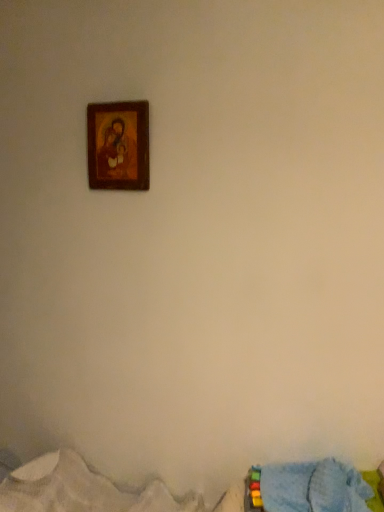
The height and width of the screenshot is (512, 384). I want to click on blue textured blanket at lower right, arranged as the first bed when ordered from the bottom, so click(x=82, y=490).

This screenshot has height=512, width=384. I want to click on blue fabric bed at lower right, which is the second bed from bottom to top, so click(324, 488).

From a real-world perspective, is blue fabric bed at lower right, which is the second bed from bottom to top, above or below wooden frame at upper center?

From a real-world perspective, blue fabric bed at lower right, which is the second bed from bottom to top, is physically below wooden frame at upper center.

Who is taller, blue fabric bed at lower right, marked as the 1th bed in a top-to-bottom arrangement, or wooden frame at upper center?

Standing taller between the two is wooden frame at upper center.

Which point is more forward, (275, 504) or (114, 172)?

Positioned in front is point (275, 504).

Consider the image. From the image's perspective, which one is positioned lower, blue fabric bed at lower right, which is the second bed from bottom to top, or wooden frame at upper center?

blue fabric bed at lower right, which is the second bed from bottom to top, appears lower in the image.

At what (x,y) coordinates should I click in order to perform the action: click on picture frame above the blue textured blanket at lower right, arranged as the first bed when ordered from the bottom (from a real-world perspective). Please return your answer as a coordinate pair (x, y). This screenshot has width=384, height=512. Looking at the image, I should click on (118, 145).

Is wooden frame at upper center positioned far away from blue textured blanket at lower right, arranged as the first bed when ordered from the bottom?

Yes, wooden frame at upper center is far from blue textured blanket at lower right, arranged as the first bed when ordered from the bottom.

Considering the sizes of objects wooden frame at upper center and blue textured blanket at lower right, arranged as the first bed when ordered from the bottom, in the image provided, who is smaller, wooden frame at upper center or blue textured blanket at lower right, arranged as the first bed when ordered from the bottom,?

With smaller size is wooden frame at upper center.

Is wooden frame at upper center taller or shorter than blue textured blanket at lower right, which is counted as the second bed, starting from the top?

Clearly, wooden frame at upper center is taller compared to blue textured blanket at lower right, which is counted as the second bed, starting from the top.

Are blue textured blanket at lower right, which is counted as the second bed, starting from the top, and wooden frame at upper center making contact?

No, blue textured blanket at lower right, which is counted as the second bed, starting from the top, is not making contact with wooden frame at upper center.

Is blue textured blanket at lower right, which is counted as the second bed, starting from the top, oriented towards wooden frame at upper center?

No, blue textured blanket at lower right, which is counted as the second bed, starting from the top, is not aimed at wooden frame at upper center.

From a real-world perspective, is blue textured blanket at lower right, arranged as the first bed when ordered from the bottom, positioned under wooden frame at upper center based on gravity?

Yes, from a real-world perspective, blue textured blanket at lower right, arranged as the first bed when ordered from the bottom, is beneath wooden frame at upper center.

Who is taller, blue fabric bed at lower right, marked as the 1th bed in a top-to-bottom arrangement, or blue textured blanket at lower right, which is counted as the second bed, starting from the top?

With more height is blue fabric bed at lower right, marked as the 1th bed in a top-to-bottom arrangement.

Is the surface of blue fabric bed at lower right, marked as the 1th bed in a top-to-bottom arrangement, in direct contact with blue textured blanket at lower right, which is counted as the second bed, starting from the top?

No, blue fabric bed at lower right, marked as the 1th bed in a top-to-bottom arrangement, is not in contact with blue textured blanket at lower right, which is counted as the second bed, starting from the top.

Can you confirm if blue fabric bed at lower right, which is the second bed from bottom to top, is smaller than blue textured blanket at lower right, arranged as the first bed when ordered from the bottom?

Yes, blue fabric bed at lower right, which is the second bed from bottom to top, is smaller than blue textured blanket at lower right, arranged as the first bed when ordered from the bottom.

Is blue fabric bed at lower right, which is the second bed from bottom to top, positioned with its back to blue textured blanket at lower right, arranged as the first bed when ordered from the bottom?

Yes, blue textured blanket at lower right, arranged as the first bed when ordered from the bottom, is at the back of blue fabric bed at lower right, which is the second bed from bottom to top.

From a real-world perspective, relative to blue fabric bed at lower right, which is the second bed from bottom to top, is blue textured blanket at lower right, which is counted as the second bed, starting from the top, vertically above or below?

blue textured blanket at lower right, which is counted as the second bed, starting from the top, is situated lower than blue fabric bed at lower right, which is the second bed from bottom to top, in the real world.

How much distance is there between blue textured blanket at lower right, which is counted as the second bed, starting from the top, and blue fabric bed at lower right, marked as the 1th bed in a top-to-bottom arrangement?

The distance of blue textured blanket at lower right, which is counted as the second bed, starting from the top, from blue fabric bed at lower right, marked as the 1th bed in a top-to-bottom arrangement, is 16.84 inches.

Between blue textured blanket at lower right, arranged as the first bed when ordered from the bottom, and blue fabric bed at lower right, marked as the 1th bed in a top-to-bottom arrangement, which one has larger size?

Bigger between the two is blue textured blanket at lower right, arranged as the first bed when ordered from the bottom.

Choose the correct answer: Is blue textured blanket at lower right, arranged as the first bed when ordered from the bottom, inside blue fabric bed at lower right, which is the second bed from bottom to top, or outside it?

blue textured blanket at lower right, arranged as the first bed when ordered from the bottom, is spatially situated outside blue fabric bed at lower right, which is the second bed from bottom to top.

This screenshot has height=512, width=384. I want to click on picture frame above the blue fabric bed at lower right, marked as the 1th bed in a top-to-bottom arrangement (from the image's perspective), so click(x=118, y=145).

Considering the relative positions of wooden frame at upper center and blue fabric bed at lower right, which is the second bed from bottom to top, in the image provided, is wooden frame at upper center to the right of blue fabric bed at lower right, which is the second bed from bottom to top, from the viewer's perspective?

No, wooden frame at upper center is not to the right of blue fabric bed at lower right, which is the second bed from bottom to top.

Which object is more forward, wooden frame at upper center or blue fabric bed at lower right, which is the second bed from bottom to top?

blue fabric bed at lower right, which is the second bed from bottom to top, is in front.

From a real-world perspective, is wooden frame at upper center on top of blue fabric bed at lower right, which is the second bed from bottom to top?

Indeed, from a real-world perspective, wooden frame at upper center stands above blue fabric bed at lower right, which is the second bed from bottom to top.

Which bed is the 1st one when counting from the front of the wooden frame at upper center? Please provide its 2D coordinates.

[(324, 488)]

Image resolution: width=384 pixels, height=512 pixels. I want to click on picture frame that is above the blue textured blanket at lower right, arranged as the first bed when ordered from the bottom (from a real-world perspective), so click(x=118, y=145).

When comparing their distances from blue textured blanket at lower right, arranged as the first bed when ordered from the bottom, does wooden frame at upper center or blue fabric bed at lower right, marked as the 1th bed in a top-to-bottom arrangement, seem further?

wooden frame at upper center.

Which object lies nearer to the anchor point wooden frame at upper center, blue textured blanket at lower right, arranged as the first bed when ordered from the bottom, or blue fabric bed at lower right, marked as the 1th bed in a top-to-bottom arrangement?

Among the two, blue textured blanket at lower right, arranged as the first bed when ordered from the bottom, is located nearer to wooden frame at upper center.

Which object lies nearer to the anchor point blue fabric bed at lower right, which is the second bed from bottom to top, blue textured blanket at lower right, arranged as the first bed when ordered from the bottom, or wooden frame at upper center?

Based on the image, blue textured blanket at lower right, arranged as the first bed when ordered from the bottom, appears to be nearer to blue fabric bed at lower right, which is the second bed from bottom to top.

From the picture: Based on their spatial positions, is blue fabric bed at lower right, which is the second bed from bottom to top, or wooden frame at upper center further from blue textured blanket at lower right, arranged as the first bed when ordered from the bottom?

Based on the image, wooden frame at upper center appears to be further to blue textured blanket at lower right, arranged as the first bed when ordered from the bottom.

Looking at the image, which one is located further to blue fabric bed at lower right, marked as the 1th bed in a top-to-bottom arrangement, wooden frame at upper center or blue textured blanket at lower right, arranged as the first bed when ordered from the bottom?

The object further to blue fabric bed at lower right, marked as the 1th bed in a top-to-bottom arrangement, is wooden frame at upper center.

Considering their positions, is blue fabric bed at lower right, marked as the 1th bed in a top-to-bottom arrangement, positioned further to wooden frame at upper center than blue textured blanket at lower right, which is counted as the second bed, starting from the top?

blue fabric bed at lower right, marked as the 1th bed in a top-to-bottom arrangement, is positioned further to the anchor wooden frame at upper center.

Locate an element on the screen. This screenshot has width=384, height=512. bed between wooden frame at upper center and blue textured blanket at lower right, which is counted as the second bed, starting from the top, from top to bottom is located at coordinates (324, 488).